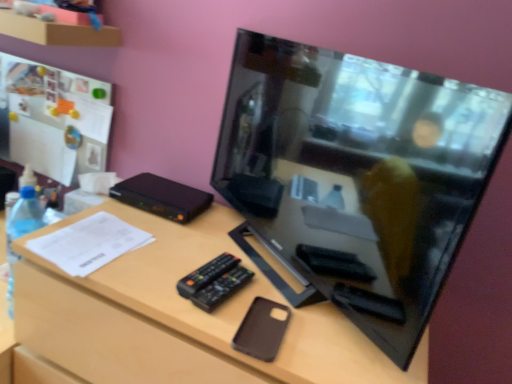
At what (x,y) coordinates should I click in order to perform the action: click on vacant area to the left of black plastic remote at center. Please return your answer as a coordinate pair (x, y). The width and height of the screenshot is (512, 384). Looking at the image, I should click on (152, 259).